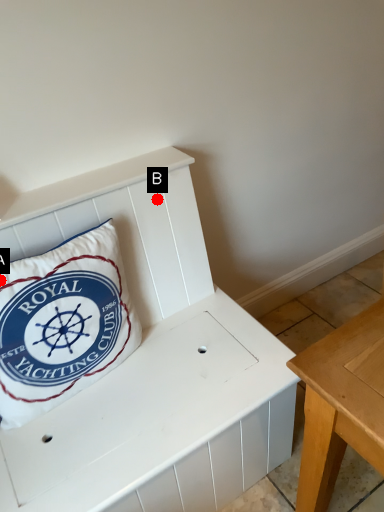
Question: Two points are circled on the image, labeled by A and B beside each circle. Which point is closer to the camera?

Choices:
 (A) A is closer
 (B) B is closer

Answer: (A)